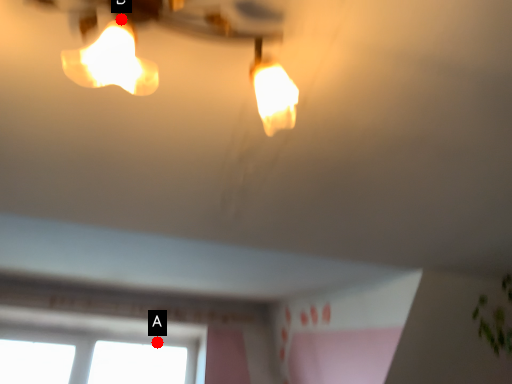
Question: Two points are circled on the image, labeled by A and B beside each circle. Which point appears closest to the camera in this image?

Choices:
 (A) A is closer
 (B) B is closer

Answer: (B)